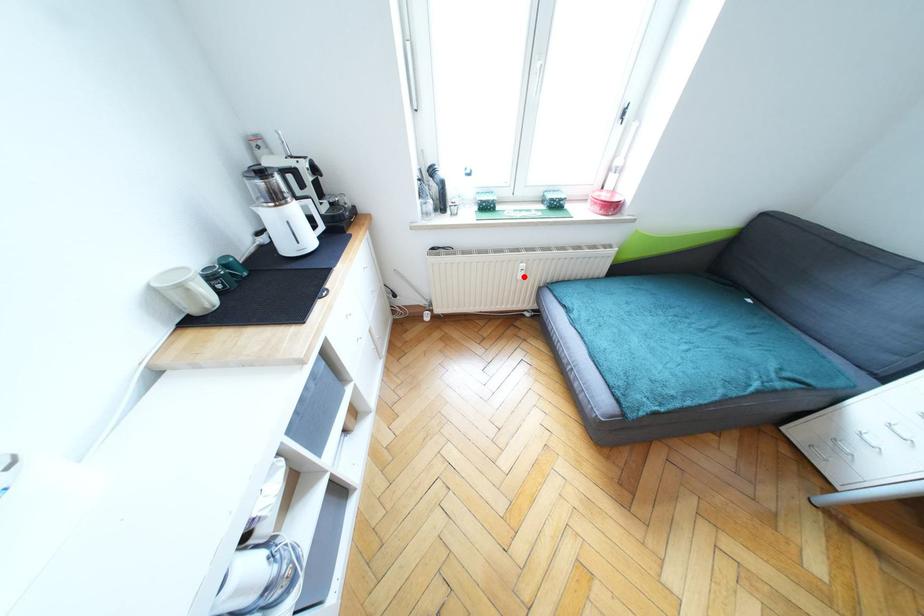
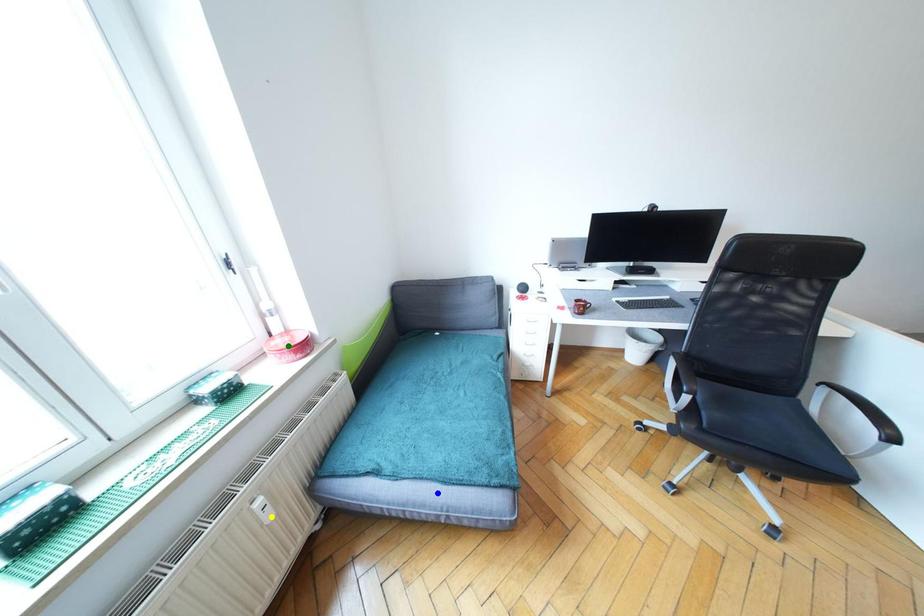
Question: I am providing you with two images of the same scene from different viewpoints. A red point is marked on the first image. You are given multiple points on the second image. Which point in image 2 represents the same 3d spot as the red point in image 1?

Choices:
 (A) green point
 (B) yellow point
 (C) blue point

Answer: (B)